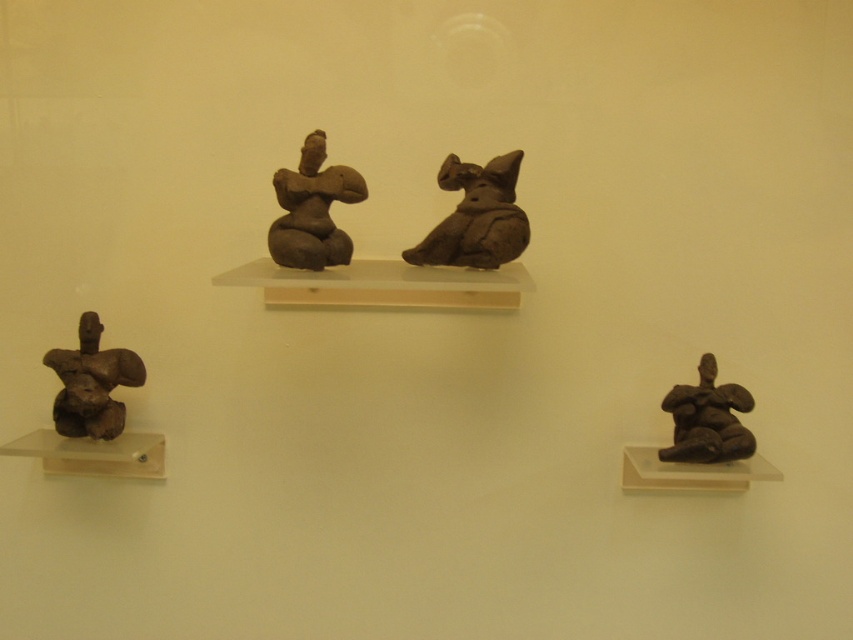
Between matte clay figure at center and matte brown figure at lower right, which one has less height?

matte brown figure at lower right is shorter.

Between matte clay figure at center and matte brown figure at lower right, which one has more height?

Standing taller between the two is matte clay figure at center.

Where is `matte clay figure at center`? The image size is (853, 640). matte clay figure at center is located at coordinates (312, 209).

What do you see at coordinates (476, 216) in the screenshot? This screenshot has width=853, height=640. I see `matte clay cat at center` at bounding box center [476, 216].

Between matte clay cat at center and matte clay figure at center, which one has more height?

With more height is matte clay figure at center.

This screenshot has height=640, width=853. Describe the element at coordinates (476, 216) in the screenshot. I see `matte clay cat at center` at that location.

I want to click on matte clay cat at center, so click(476, 216).

Does matte brown statue at lower left appear under matte brown figure at lower right?

No.

Between point (97, 348) and point (717, 460), which one is positioned in front?

Positioned in front is point (717, 460).

Find the location of `matte brown statue at lower left`. matte brown statue at lower left is located at coordinates [x=91, y=384].